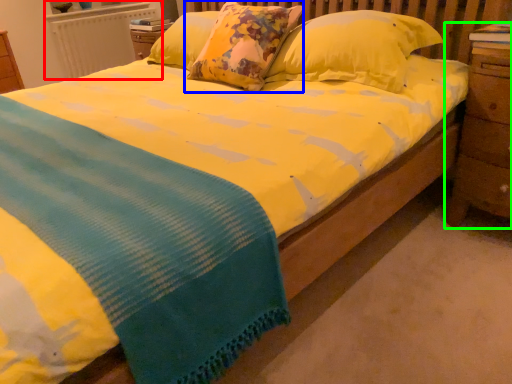
Question: Considering the real-world distances, which object is farthest from radiator (highlighted by a red box)? pillow (highlighted by a blue box) or nightstand (highlighted by a green box)?

Choices:
 (A) pillow
 (B) nightstand

Answer: (B)